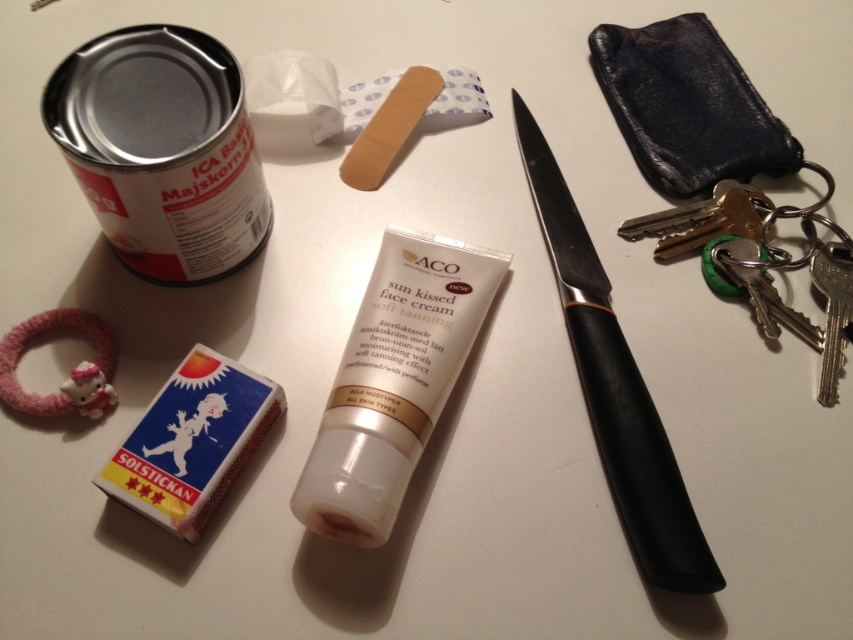
Question: Does silver metallic can at upper left appear under blue cardboard matchbox at lower left?

Choices:
 (A) yes
 (B) no

Answer: (B)

Question: Based on their relative distances, which object is farther from the black plastic knife at upper right?

Choices:
 (A) blue cardboard matchbox at lower left
 (B) white matte tube at center
 (C) silver metallic can at upper left

Answer: (C)

Question: Which object is farther from the camera taking this photo?

Choices:
 (A) black plastic knife at upper right
 (B) silver metallic can at upper left
 (C) white matte tube at center

Answer: (B)

Question: Among these points, which one is farthest from the camera?

Choices:
 (A) (190, 403)
 (B) (392, 330)

Answer: (B)

Question: Considering the relative positions of white matte tube at center and blue cardboard matchbox at lower left in the image provided, where is white matte tube at center located with respect to blue cardboard matchbox at lower left?

Choices:
 (A) left
 (B) right

Answer: (B)

Question: Where is white matte tube at center located in relation to blue cardboard matchbox at lower left in the image?

Choices:
 (A) right
 (B) left

Answer: (A)